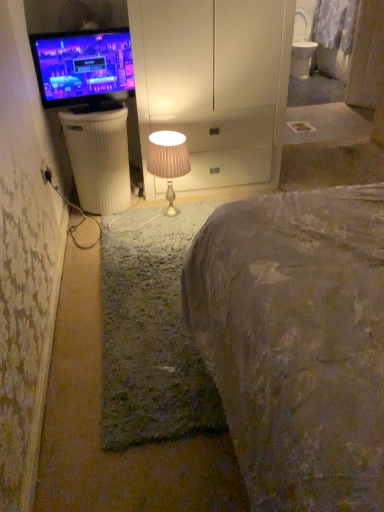
This screenshot has width=384, height=512. Describe the element at coordinates (83, 66) in the screenshot. I see `matte black tv at left` at that location.

Describe the element at coordinates (46, 172) in the screenshot. I see `black plastic electric outlet at lower left` at that location.

The height and width of the screenshot is (512, 384). What do you see at coordinates (168, 161) in the screenshot?
I see `matte beige lampshade at center` at bounding box center [168, 161].

Find the location of a particular element. white ribbed plastic trash bin/can at left is located at coordinates (99, 156).

Considering the sizes of matte black tv at left and white ribbed plastic trash bin/can at left in the image, is matte black tv at left taller or shorter than white ribbed plastic trash bin/can at left?

In the image, matte black tv at left appears to be shorter than white ribbed plastic trash bin/can at left.

From the image's perspective, is matte black tv at left on white ribbed plastic trash bin/can at left?

Indeed, from the image's perspective, matte black tv at left is shown above white ribbed plastic trash bin/can at left.

Considering the relative positions of matte black tv at left and white ribbed plastic trash bin/can at left in the image provided, is matte black tv at left to the left or to the right of white ribbed plastic trash bin/can at left?

In the image, matte black tv at left appears on the left side of white ribbed plastic trash bin/can at left.

From the image's perspective, which one is positioned higher, black plastic electric outlet at lower left or matte black tv at left?

matte black tv at left, from the image's perspective.

Does point (51, 173) appear closer or farther from the camera than point (35, 41)?

Point (51, 173) is positioned farther from the camera compared to point (35, 41).

Who is taller, black plastic electric outlet at lower left or matte black tv at left?

matte black tv at left is taller.

At what (x,y) coordinates should I click in order to perform the action: click on television behind the black plastic electric outlet at lower left. Please return your answer as a coordinate pair (x, y). This screenshot has width=384, height=512. Looking at the image, I should click on (83, 66).

Measure the distance between white ribbed plastic trash bin/can at left and matte beige lampshade at center.

white ribbed plastic trash bin/can at left and matte beige lampshade at center are 12.63 inches apart.

Between white ribbed plastic trash bin/can at left and matte beige lampshade at center, which one has smaller width?

Thinner between the two is matte beige lampshade at center.

Who is smaller, white ribbed plastic trash bin/can at left or matte beige lampshade at center?

Smaller between the two is matte beige lampshade at center.

Is white ribbed plastic trash bin/can at left oriented away from matte beige lampshade at center?

No, white ribbed plastic trash bin/can at left's orientation is not away from matte beige lampshade at center.

Is matte beige lampshade at center with black plastic electric outlet at lower left?

They are not placed beside each other.

Is matte beige lampshade at center situated inside black plastic electric outlet at lower left or outside?

The correct answer is: outside.

From the picture: In the image, is matte beige lampshade at center on the left side or the right side of black plastic electric outlet at lower left?

matte beige lampshade at center is positioned on black plastic electric outlet at lower left's right side.

Considering the positions of point (155, 170) and point (42, 176), is point (155, 170) closer or farther from the camera than point (42, 176)?

Point (155, 170).

Based on the photo, between white ribbed plastic trash bin/can at left and black plastic electric outlet at lower left, which one appears on the right side from the viewer's perspective?

white ribbed plastic trash bin/can at left.

Does white ribbed plastic trash bin/can at left have a smaller size compared to black plastic electric outlet at lower left?

No, white ribbed plastic trash bin/can at left is not smaller than black plastic electric outlet at lower left.

From a real-world perspective, is white ribbed plastic trash bin/can at left physically above black plastic electric outlet at lower left?

No.

Based on the photo, considering the sizes of black plastic electric outlet at lower left and matte beige lampshade at center in the image, is black plastic electric outlet at lower left wider or thinner than matte beige lampshade at center?

Clearly, black plastic electric outlet at lower left has less width compared to matte beige lampshade at center.

From the image's perspective, which one is positioned lower, black plastic electric outlet at lower left or matte beige lampshade at center?

black plastic electric outlet at lower left is shown below in the image.

Can you confirm if black plastic electric outlet at lower left is bigger than matte beige lampshade at center?

No, black plastic electric outlet at lower left is not bigger than matte beige lampshade at center.

Considering the positions of objects black plastic electric outlet at lower left and matte beige lampshade at center in the image provided, who is more to the right, black plastic electric outlet at lower left or matte beige lampshade at center?

From the viewer's perspective, matte beige lampshade at center appears more on the right side.

From a real-world perspective, is matte beige lampshade at center positioned over matte black tv at left based on gravity?

No.

How far apart are matte beige lampshade at center and matte black tv at left?

matte beige lampshade at center and matte black tv at left are 20.54 inches apart.

Is matte beige lampshade at center with matte black tv at left?

No.

Image resolution: width=384 pixels, height=512 pixels. Find the location of `television lying above the matte beige lampshade at center (from the image's perspective)`. television lying above the matte beige lampshade at center (from the image's perspective) is located at coordinates (83, 66).

You are a GUI agent. You are given a task and a screenshot of the screen. Output one action in this format:
    pyautogui.click(x=<x>, y=<y>)
    Task: Click on the television that appears on the left of white ribbed plastic trash bin/can at left
    Image resolution: width=384 pixels, height=512 pixels.
    Given the screenshot: What is the action you would take?
    pyautogui.click(x=83, y=66)

The width and height of the screenshot is (384, 512). Find the location of `television lying on the right of black plastic electric outlet at lower left`. television lying on the right of black plastic electric outlet at lower left is located at coordinates (83, 66).

Based on their spatial positions, is black plastic electric outlet at lower left or matte black tv at left closer to matte beige lampshade at center?

matte black tv at left lies closer to matte beige lampshade at center than the other object.

From the picture: Based on their spatial positions, is matte black tv at left or matte beige lampshade at center closer to black plastic electric outlet at lower left?

matte black tv at left is closer to black plastic electric outlet at lower left.

Based on their spatial positions, is matte black tv at left or white ribbed plastic trash bin/can at left closer to matte beige lampshade at center?

Among the two, white ribbed plastic trash bin/can at left is located nearer to matte beige lampshade at center.

Looking at the image, which one is located closer to black plastic electric outlet at lower left, matte beige lampshade at center or white ribbed plastic trash bin/can at left?

white ribbed plastic trash bin/can at left.

From the image, which object appears to be nearer to matte beige lampshade at center, white ribbed plastic trash bin/can at left or matte black tv at left?

The object closer to matte beige lampshade at center is white ribbed plastic trash bin/can at left.

Which object lies nearer to the anchor point matte beige lampshade at center, black plastic electric outlet at lower left or white ribbed plastic trash bin/can at left?

white ribbed plastic trash bin/can at left.

Which object lies nearer to the anchor point black plastic electric outlet at lower left, white ribbed plastic trash bin/can at left or matte black tv at left?

white ribbed plastic trash bin/can at left lies closer to black plastic electric outlet at lower left than the other object.

Based on the photo, when comparing their distances from matte black tv at left, does matte beige lampshade at center or white ribbed plastic trash bin/can at left seem further?

Based on the image, matte beige lampshade at center appears to be further to matte black tv at left.

Identify the location of lamp between matte black tv at left and black plastic electric outlet at lower left in the vertical direction. tap(168, 161).

I want to click on trash bin/can between matte black tv at left and matte beige lampshade at center in the vertical direction, so click(99, 156).

Where is `trash bin/can between black plastic electric outlet at lower left and matte beige lampshade at center`? The height and width of the screenshot is (512, 384). trash bin/can between black plastic electric outlet at lower left and matte beige lampshade at center is located at coordinates (99, 156).

Where is `trash bin/can between matte black tv at left and black plastic electric outlet at lower left vertically`? The width and height of the screenshot is (384, 512). trash bin/can between matte black tv at left and black plastic electric outlet at lower left vertically is located at coordinates (99, 156).